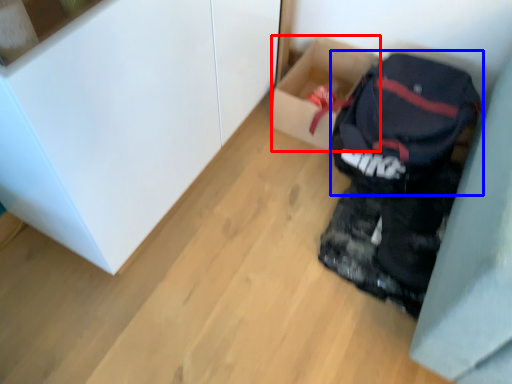
Question: Which point is closer to the camera, box (highlighted by a red box) or backpack (highlighted by a blue box)?

Choices:
 (A) box
 (B) backpack

Answer: (B)